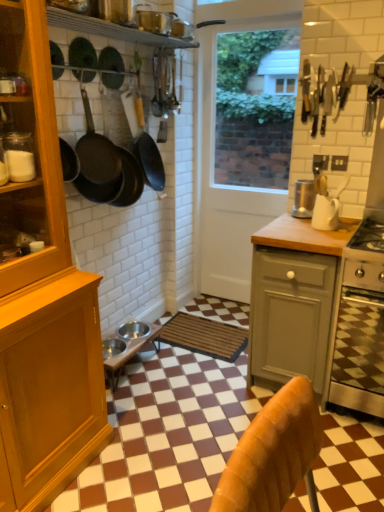
This screenshot has height=512, width=384. Identify the location of vacant area that is in front of metallic silver bowls at center. (153, 408).